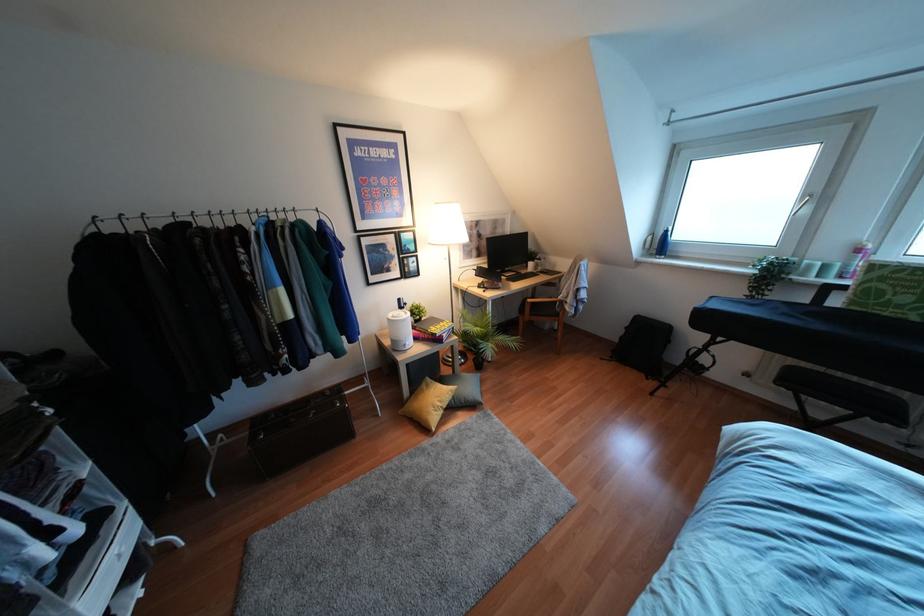
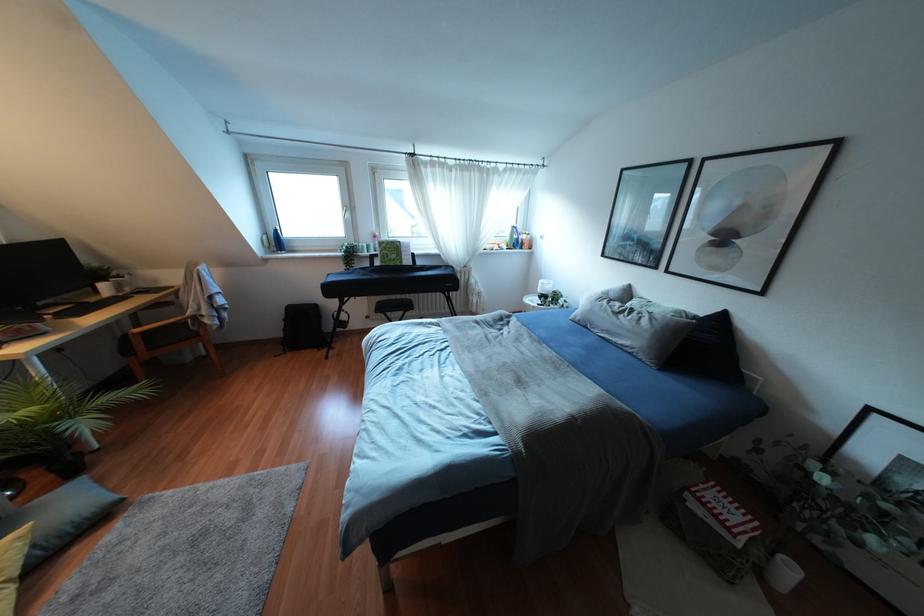
Find the pixel in the second image that matches the point at 555,314 in the first image.

(196, 334)